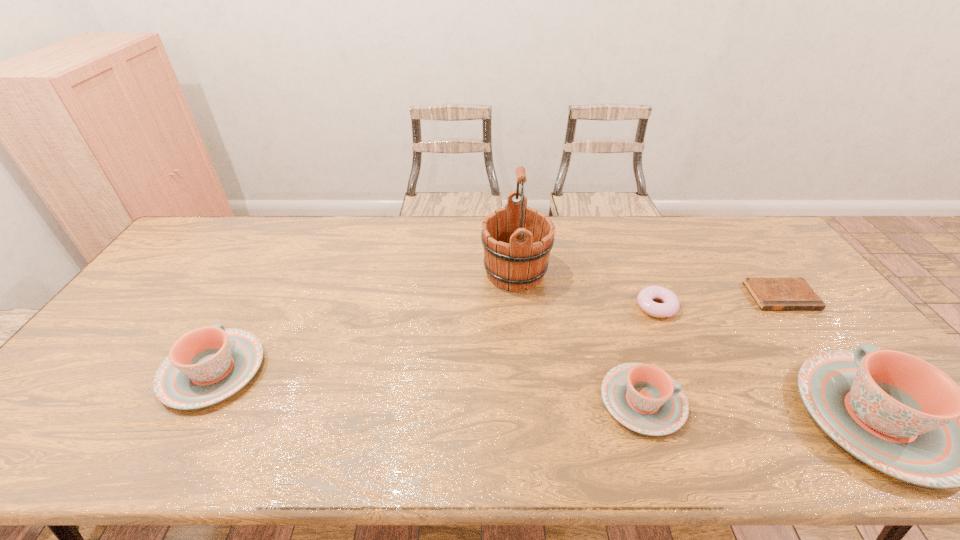
The height and width of the screenshot is (540, 960). Identify the location of free location located 0.090m on the handle side of the second shortest chinaware. (247, 310).

The width and height of the screenshot is (960, 540). What are the coordinates of `vacant region located 0.360m on the handle side of the second chinaware from left to right` in the screenshot? It's located at (834, 401).

At what (x,y) coordinates should I click in order to perform the action: click on vacant space positioned 0.180m on the left of the doughnut. Please return your answer as a coordinate pair (x, y). The image size is (960, 540). Looking at the image, I should click on (574, 307).

What are the coordinates of `vacant space located 0.100m on the front of the fifth object from right to left` in the screenshot? It's located at (519, 323).

I want to click on free space located 0.340m on the spine side of the shortest object, so click(870, 415).

You are a GUI agent. You are given a task and a screenshot of the screen. Output one action in this format:
    pyautogui.click(x=<x>, y=<y>)
    Task: Click on the object that is at the far edge
    The height and width of the screenshot is (540, 960).
    Given the screenshot: What is the action you would take?
    pyautogui.click(x=517, y=240)

Where is `object situated at the right edge`? object situated at the right edge is located at coordinates (769, 293).

Find the location of a particular element. The width and height of the screenshot is (960, 540). vacant area at the far edge of the desktop is located at coordinates (367, 239).

In the image, there is a desktop. Where is `vacant region at the near edge`? This screenshot has width=960, height=540. vacant region at the near edge is located at coordinates (758, 401).

Where is `free point at the left edge`? Image resolution: width=960 pixels, height=540 pixels. free point at the left edge is located at coordinates (129, 343).